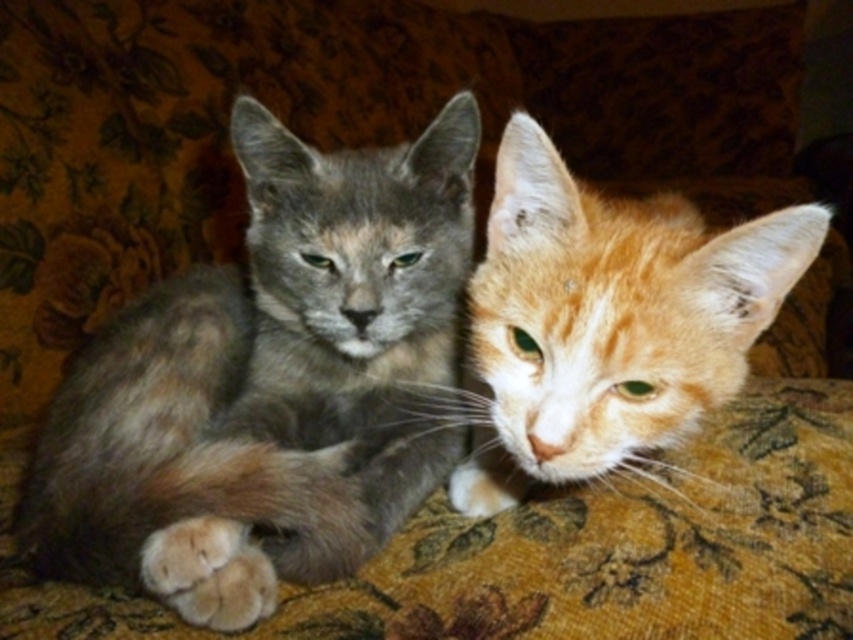
Who is more distant from viewer, (451, 458) or (607, 381)?

The point (451, 458) is more distant.

Is point (160, 483) in front of point (525, 442)?

Yes, it is in front of point (525, 442).

At what (x,y) coordinates should I click in order to perform the action: click on gray fur cat at center. Please return your answer as a coordinate pair (x, y). Image resolution: width=853 pixels, height=640 pixels. Looking at the image, I should click on (271, 384).